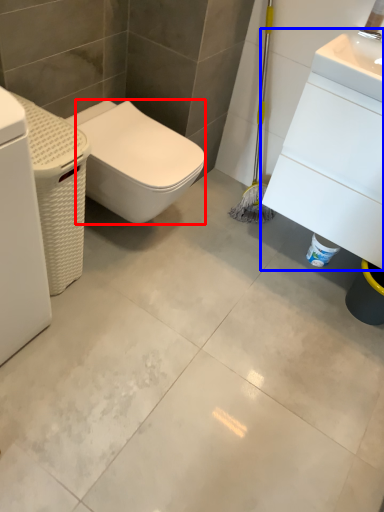
Question: Which object is further to the camera taking this photo, bidet (highlighted by a red box) or porcelain (highlighted by a blue box)?

Choices:
 (A) bidet
 (B) porcelain

Answer: (A)